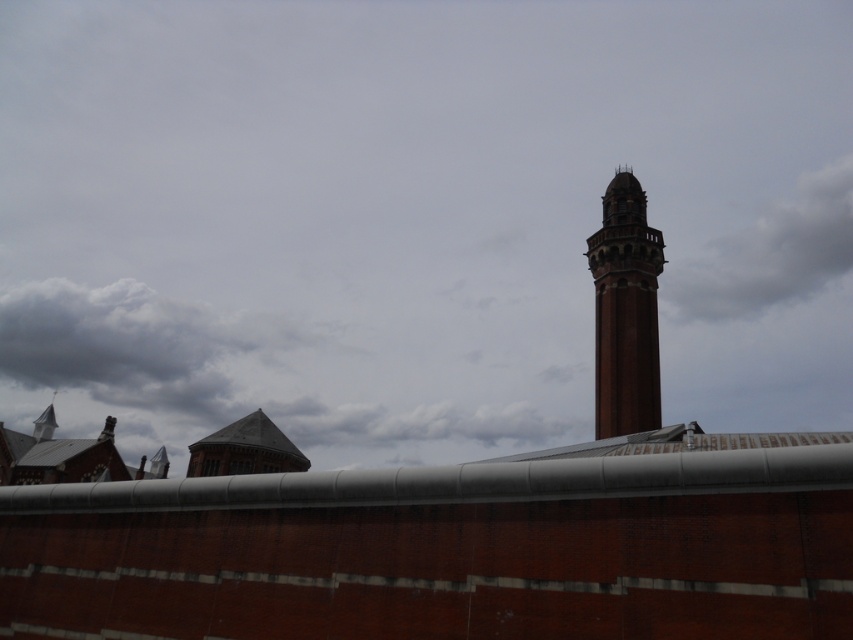
Based on the photo, you are an architect analyzing the image of a historical building complex. You notice the gray fluffy cloud at upper right and the brick tower at right. Which object in the scene has a greater visual size when viewed from the ground level?

The gray fluffy cloud at upper right has a larger size compared to the brick tower at right, so it appears bigger in the image.

You are standing in front of the brick wall and notice the gray fluffy cloud at lower left and the brick tower at right. Which object is closer to you from your current position?

The gray fluffy cloud at lower left is closer to you because it is in front of the brick tower at right, which is positioned behind it.